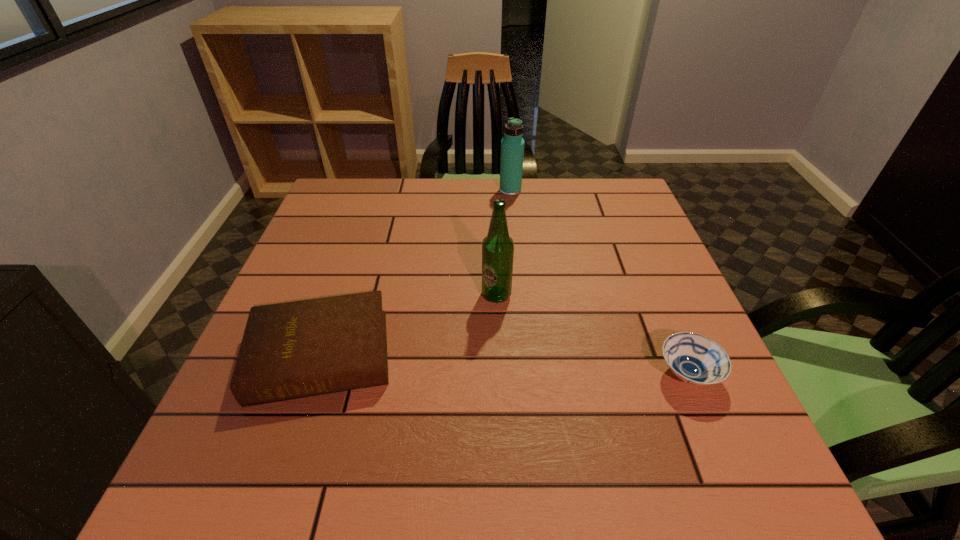
Find the location of a particular element. This screenshot has width=960, height=540. beer bottle is located at coordinates (497, 247).

The height and width of the screenshot is (540, 960). Identify the location of thermos bottle. (512, 145).

Find the location of a particular element. the leftmost object is located at coordinates (290, 350).

In order to click on soup bowl in this screenshot , I will do `click(693, 358)`.

This screenshot has width=960, height=540. I want to click on the shortest object, so click(x=693, y=358).

The width and height of the screenshot is (960, 540). I want to click on free space located on the label of the beer bottle, so click(x=501, y=416).

What are the coordinates of `free space located on the right of the thermos bottle` in the screenshot? It's located at (567, 191).

The width and height of the screenshot is (960, 540). Find the location of `vacant space located on the back of the leftmost object`. vacant space located on the back of the leftmost object is located at coordinates (364, 226).

Locate an element on the screen. This screenshot has height=540, width=960. vacant area situated on the left of the rightmost object is located at coordinates (625, 374).

This screenshot has width=960, height=540. In order to click on object located at the far edge in this screenshot , I will do `click(512, 145)`.